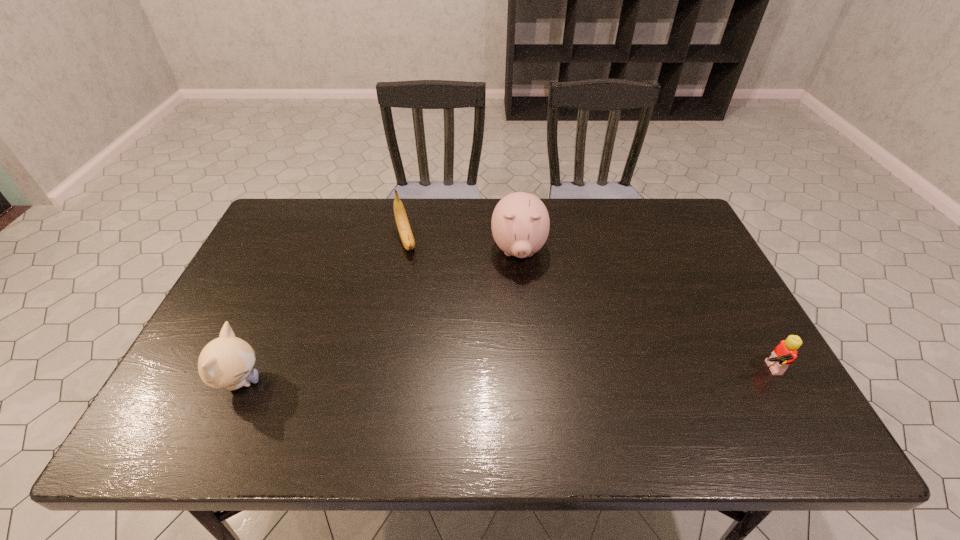
This screenshot has width=960, height=540. I want to click on vacant space on the desktop that is between the leftmost object and the shortest object and is positioned at the snout of the second object from right to left, so click(523, 374).

This screenshot has width=960, height=540. Find the location of `vacant spot on the desktop that is between the leftmost object and the Lego and is positioned at the start of the peel on the second object from left to right`. vacant spot on the desktop that is between the leftmost object and the Lego and is positioned at the start of the peel on the second object from left to right is located at coordinates (457, 376).